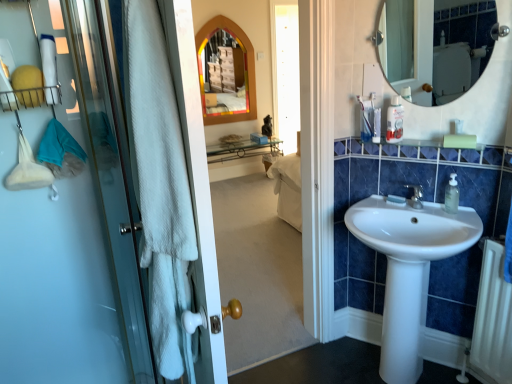
Identify the location of clear plastic bottle at upper right. Image resolution: width=512 pixels, height=384 pixels. (452, 195).

This screenshot has height=384, width=512. Describe the element at coordinates (71, 246) in the screenshot. I see `white textured towel at left` at that location.

You are a GUI agent. You are given a task and a screenshot of the screen. Output one action in this format:
    pyautogui.click(x=<x>, y=<y>)
    Task: Click on the multicolored glass medicine cabinet at center
    This screenshot has width=512, height=384.
    Given the screenshot: What is the action you would take?
    click(x=245, y=65)

The image size is (512, 384). Find the location of `clear plastic bottle at upper right`. clear plastic bottle at upper right is located at coordinates pyautogui.click(x=395, y=121).

Is white glossy mirror at upper right closer to the viewer compared to white metallic radiator at lower right?

Yes, white glossy mirror at upper right is in front of white metallic radiator at lower right.

Which point is more distant from viewer, [457,13] or [505,372]?

Positioned behind is point [457,13].

Who is smaller, white glossy mirror at upper right or white metallic radiator at lower right?

With smaller size is white metallic radiator at lower right.

Is the surface of clear plastic bottle at upper right in direct contact with clear plastic bottle at upper right?

No, clear plastic bottle at upper right is not in contact with clear plastic bottle at upper right.

Considering the relative positions of clear plastic bottle at upper right and clear plastic bottle at upper right in the image provided, is clear plastic bottle at upper right to the right of clear plastic bottle at upper right from the viewer's perspective?

Yes, clear plastic bottle at upper right is to the right of clear plastic bottle at upper right.

Where is `toiletry to the left of clear plastic bottle at upper right`? Image resolution: width=512 pixels, height=384 pixels. toiletry to the left of clear plastic bottle at upper right is located at coordinates (395, 121).

From the image's perspective, between clear plastic bottle at upper right and clear plastic bottle at upper right, which one is located above?

clear plastic bottle at upper right.

Are white matte soap at sink right and clear plastic bottle at upper right far apart?

No, white matte soap at sink right is in close proximity to clear plastic bottle at upper right.

In terms of height, does white matte soap at sink right look taller or shorter compared to clear plastic bottle at upper right?

Clearly, white matte soap at sink right is shorter compared to clear plastic bottle at upper right.

Is white matte soap at sink right inside or outside of clear plastic bottle at upper right?

white matte soap at sink right cannot be found inside clear plastic bottle at upper right.

Can you tell me how much white metallic radiator at lower right and clear plastic bottle at upper right differ in facing direction?

The angle between the facing direction of white metallic radiator at lower right and the facing direction of clear plastic bottle at upper right is 92.7 degrees.

From the image's perspective, is white metallic radiator at lower right positioned above or below clear plastic bottle at upper right?

From the image's perspective, white metallic radiator at lower right appears below clear plastic bottle at upper right.

Does point (493, 347) come in front of point (387, 114)?

That is True.

Is the depth of white metallic radiator at lower right greater than that of clear plastic bottle at upper right?

No.

This screenshot has height=384, width=512. In order to click on screen door located underneath the white glossy mirror at upper right (from a real-world perspective) in this screenshot , I will do `click(71, 246)`.

Which of these two, white glossy mirror at upper right or white textured towel at left, is bigger?

With larger size is white textured towel at left.

Which object is further away from the camera, white glossy mirror at upper right or white textured towel at left?

white glossy mirror at upper right.

Is white textured towel at left positioned behind white metallic radiator at lower right?

No, white textured towel at left is closer to the viewer.

Looking at their sizes, would you say white textured towel at left is wider or thinner than white metallic radiator at lower right?

In the image, white textured towel at left appears to be wider than white metallic radiator at lower right.

Can you confirm if white textured towel at left is taller than white metallic radiator at lower right?

Yes.

Is white textured towel at left to the left of white metallic radiator at lower right from the viewer's perspective?

Correct, you'll find white textured towel at left to the left of white metallic radiator at lower right.

Would you say clear plastic bottle at upper right contains white matte soap at sink right?

No.

Which of these two, clear plastic bottle at upper right or white matte soap at sink right, is wider?

With larger width is white matte soap at sink right.

From a real-world perspective, relative to white matte soap at sink right, is clear plastic bottle at upper right vertically above or below?

From a real-world perspective, clear plastic bottle at upper right is physically above white matte soap at sink right.

Is clear plastic bottle at upper right in contact with white matte soap at sink right?

There is a gap between clear plastic bottle at upper right and white matte soap at sink right.

Where is `radiator beneath the white glossy mirror at upper right (from a real-world perspective)`? radiator beneath the white glossy mirror at upper right (from a real-world perspective) is located at coordinates (493, 319).

What are the coordinates of `toiletry that appears on the left of clear plastic bottle at upper right` in the screenshot? It's located at (395, 121).

Looking at the image, which one is located further to multicolored glass medicine cabinet at center, white matte soap at sink right or white textured towel at left?

white matte soap at sink right.

Looking at the image, which one is located closer to white metallic radiator at lower right, white textured towel at left or multicolored glass medicine cabinet at center?

The object closer to white metallic radiator at lower right is white textured towel at left.

Estimate the real-world distances between objects in this image. Which object is further from white metallic radiator at lower right, white textured towel at left or white glossy mirror at upper right?

white glossy mirror at upper right is further to white metallic radiator at lower right.

From the image, which object appears to be nearer to white glossy sink at center, white textured towel at left or white matte soap at sink right?

The object closer to white glossy sink at center is white matte soap at sink right.

When comparing their distances from clear plastic bottle at upper right, does white glossy sink at center or multicolored glass medicine cabinet at center seem further?

multicolored glass medicine cabinet at center is positioned further to the anchor clear plastic bottle at upper right.

Considering their positions, is white metallic radiator at lower right positioned closer to white textured towel at left than multicolored glass medicine cabinet at center?

white metallic radiator at lower right is closer to white textured towel at left.

Considering their positions, is white matte soap at sink right positioned further to white metallic radiator at lower right than multicolored glass medicine cabinet at center?

multicolored glass medicine cabinet at center is positioned further to the anchor white metallic radiator at lower right.

Estimate the real-world distances between objects in this image. Which object is further from white metallic radiator at lower right, white matte soap at sink right or white glossy sink at center?

white matte soap at sink right is positioned further to the anchor white metallic radiator at lower right.

Identify the location of soap between clear plastic bottle at upper right and multicolored glass medicine cabinet at center in the front-back direction. (396, 199).

Where is `soap dispenser located between white textured towel at left and white matte soap at sink right in the depth direction`? This screenshot has height=384, width=512. soap dispenser located between white textured towel at left and white matte soap at sink right in the depth direction is located at coordinates (452, 195).

The width and height of the screenshot is (512, 384). Identify the location of sink between white textured towel at left and clear plastic bottle at upper right from front to back. (409, 270).

Locate an element on the screen. The image size is (512, 384). sink between clear plastic bottle at upper right and white metallic radiator at lower right in the up-down direction is located at coordinates (409, 270).